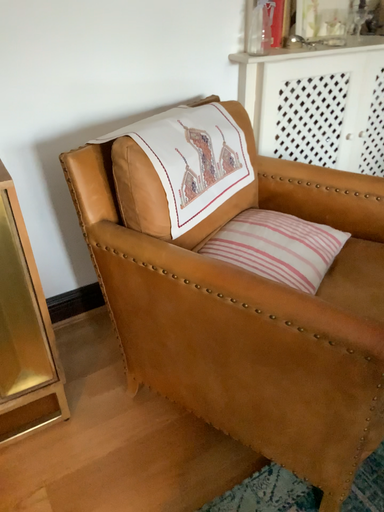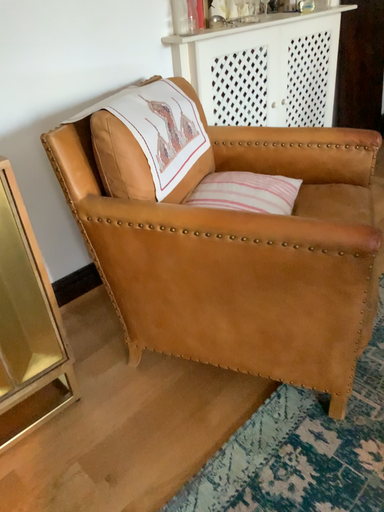
Question: Which way did the camera rotate in the video?

Choices:
 (A) rotated right
 (B) rotated left

Answer: (A)